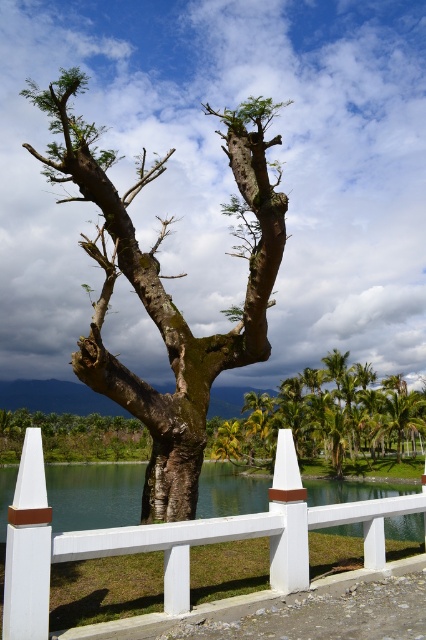
You are standing at the base of the tree and want to walk towards the point marked at point (x=129, y=476). Will you pass by point (x=261, y=108) before reaching your destination?

Yes, because point (x=261, y=108) is in front of point (x=129, y=476), so you will pass by point (x=261, y=108) first.

You are a gardener planning to install a new flower bed between the white painted wood fence at center and the green mossy tree at center. Considering their heights, which object will likely cast a shadow over the flower bed during the afternoon?

The green mossy tree at center will cast a shadow over the flower bed during the afternoon because it is taller than the white painted wood fence at center.

You are an artist planning to paint this scene. You want to ensure the green mossy tree at center and the clear water at center are proportionally accurate. Which object should you make narrower in your painting?

The green mossy tree at center has a lesser width compared to clear water at center, so you should make the green mossy tree at center narrower than the clear water at center in your painting.